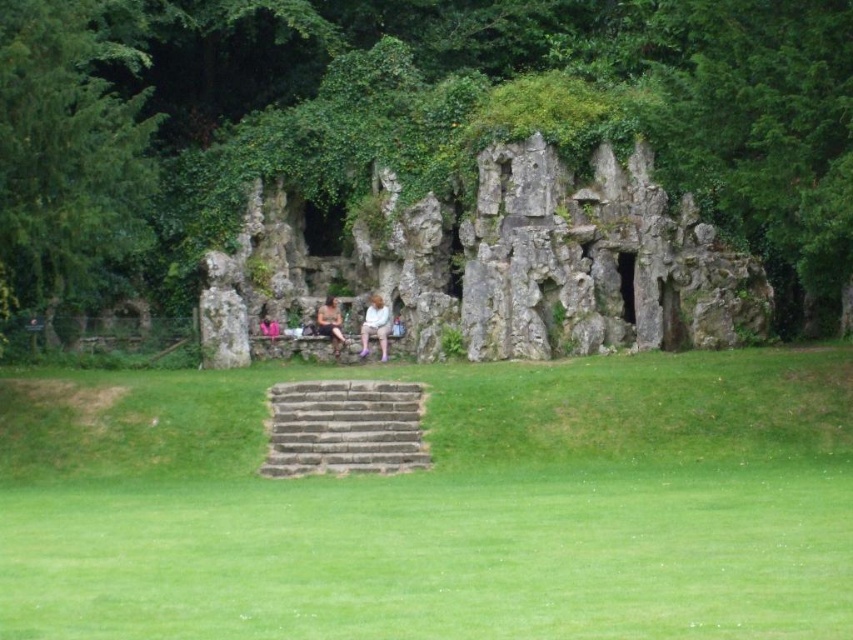
Is matte white dress at center above matte beige shirt at center?

No.

Does matte white dress at center have a lesser height compared to matte beige shirt at center?

Incorrect, matte white dress at center's height does not fall short of matte beige shirt at center's.

Where is `matte white dress at center`? matte white dress at center is located at coordinates (375, 324).

At what (x,y) coordinates should I click in order to perform the action: click on matte white dress at center. Please return your answer as a coordinate pair (x, y). The image size is (853, 640). Looking at the image, I should click on (375, 324).

Does point (811, 259) come in front of point (381, 317)?

Yes, it is.

What do you see at coordinates (404, 118) in the screenshot?
I see `green leafy tree at upper center` at bounding box center [404, 118].

Locate an element on the screen. green leafy tree at upper center is located at coordinates (404, 118).

Based on the photo, does green leafy tree at left appear on the left side of brown stone stairs at center?

Yes, green leafy tree at left is to the left of brown stone stairs at center.

Is green leafy tree at left taller than brown stone stairs at center?

Yes.

Identify the location of green leafy tree at left. tap(65, 154).

What are the coordinates of `green leafy tree at left` in the screenshot? It's located at (65, 154).